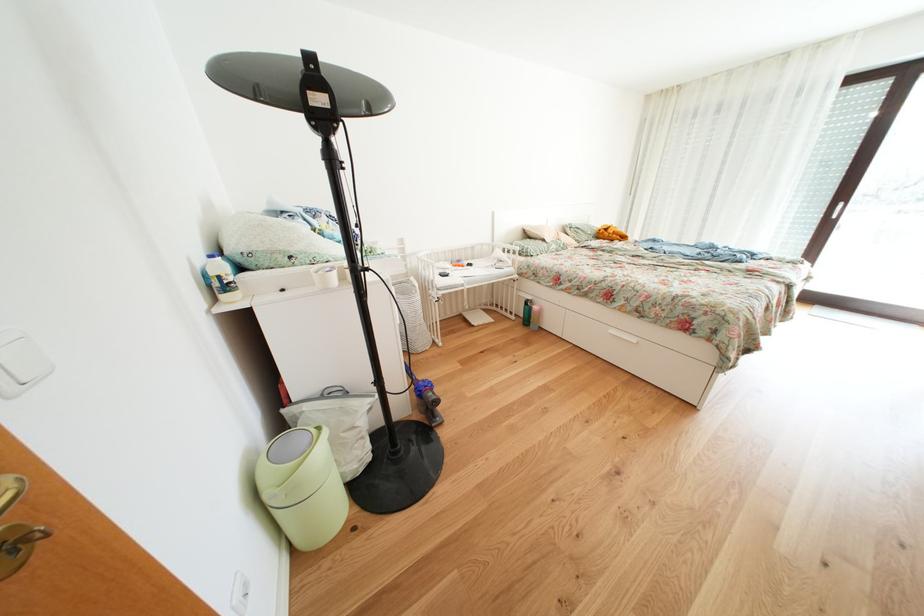
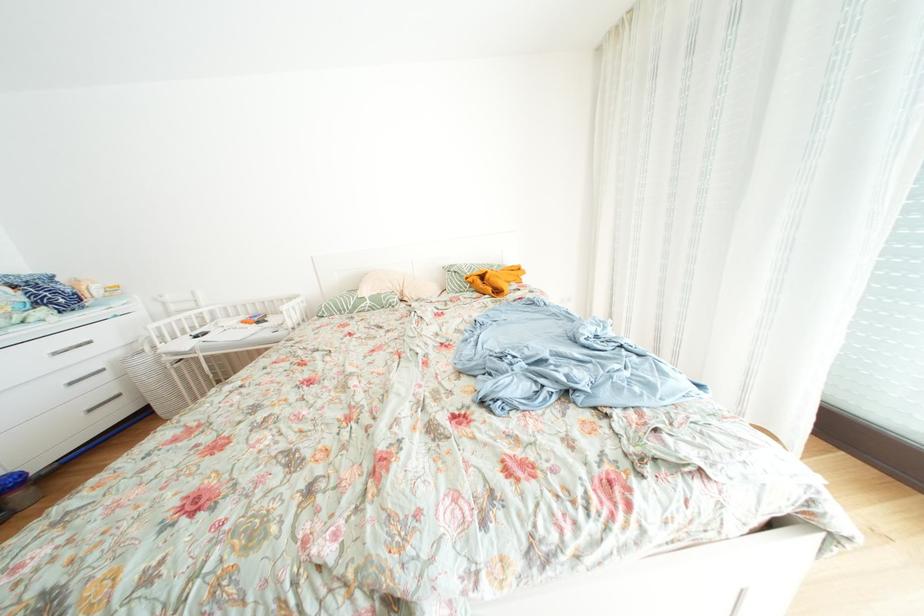
In a continuous first-person perspective shot, in which direction is the camera moving?

The movement direction of the cameraman is right, forward.